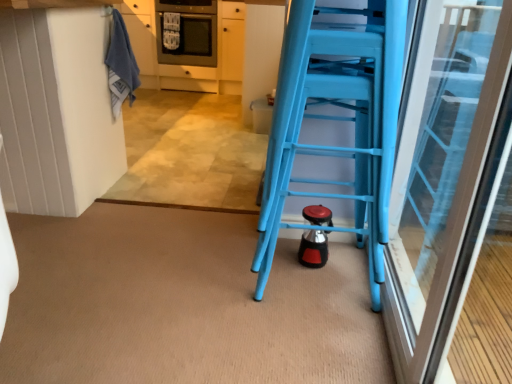
Question: In the image, is satin black oven at upper center positioned in front of or behind white matte cabinetry at upper left?

Choices:
 (A) behind
 (B) front

Answer: (B)

Question: From a real-world perspective, relative to white matte cabinetry at upper left, is satin black oven at upper center vertically above or below?

Choices:
 (A) below
 (B) above

Answer: (B)

Question: Considering the real-world distances, which object is closest to the white matte cabinetry at upper left?

Choices:
 (A) satin black oven at upper center
 (B) blue plastic ladder at right
 (C) blue towel at upper left

Answer: (A)

Question: Considering the real-world distances, which object is farthest from the blue towel at upper left?

Choices:
 (A) satin black oven at upper center
 (B) white matte cabinetry at upper left
 (C) blue plastic ladder at right

Answer: (A)